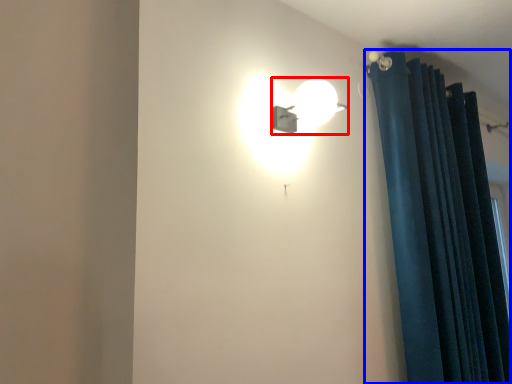
Question: Which object is further to the camera taking this photo, lamp (highlighted by a red box) or curtain (highlighted by a blue box)?

Choices:
 (A) lamp
 (B) curtain

Answer: (B)